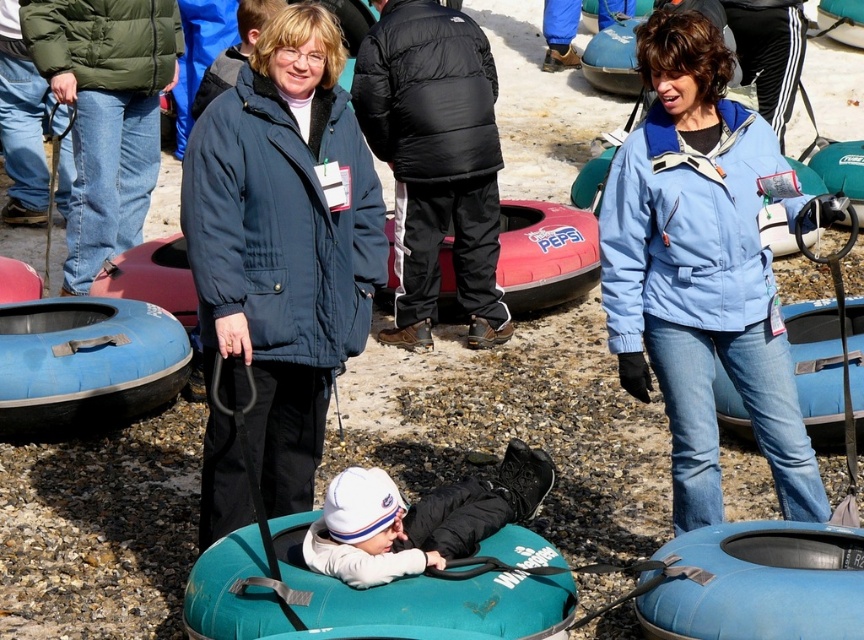
Question: Among these objects, which one is nearest to the camera?

Choices:
 (A) blue fabric jacket at upper right
 (B) teal rubber tube at center
 (C) black puffy jacket at center

Answer: (B)

Question: Which object is closer to the camera taking this photo?

Choices:
 (A) green matte jacket at upper left
 (B) teal rubber tube at center
 (C) blue rubber tube at lower right
 (D) black puffy jacket at center

Answer: (C)

Question: Does teal rubber tube at center appear under blue rubber boat at lower right?

Choices:
 (A) no
 (B) yes

Answer: (B)

Question: Does black puffy jacket at center come in front of rubber boat at center?

Choices:
 (A) yes
 (B) no

Answer: (A)

Question: Can you confirm if matte blue jacket at center is positioned below green matte jacket at upper left?

Choices:
 (A) yes
 (B) no

Answer: (A)

Question: Which object is positioned farthest from the black puffy jacket at center?

Choices:
 (A) teal rubber tube at center
 (B) black rubber handle at center
 (C) matte blue jacket at center

Answer: (A)